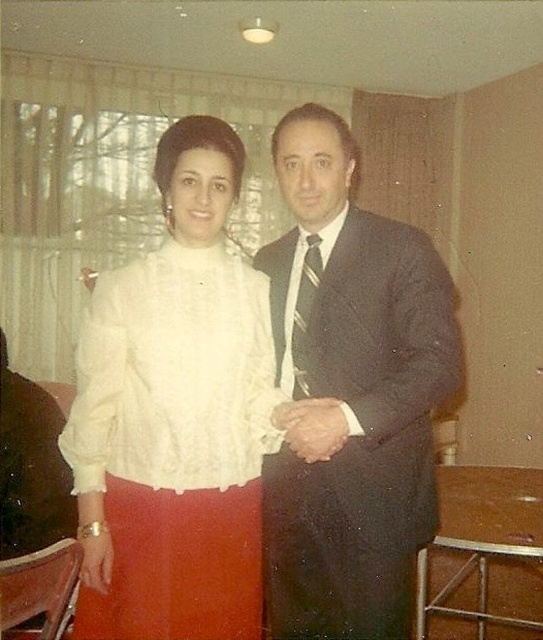
Who is more forward, (282, 192) or (318, 284)?

Point (318, 284)

Is dark gray suit at center below striped silk tie at center?

Indeed, dark gray suit at center is positioned under striped silk tie at center.

Measure the distance between point (381, 429) and camera.

Point (381, 429) and camera are 1.45 meters apart from each other.

The image size is (543, 640). In order to click on dark gray suit at center in this screenshot , I will do `click(350, 396)`.

Can you confirm if white lace blouse at center is bigger than dark gray suit at center?

No, white lace blouse at center is not bigger than dark gray suit at center.

Does white lace blouse at center have a lesser width compared to dark gray suit at center?

In fact, white lace blouse at center might be wider than dark gray suit at center.

Image resolution: width=543 pixels, height=640 pixels. What do you see at coordinates (174, 417) in the screenshot?
I see `white lace blouse at center` at bounding box center [174, 417].

At what (x,y) coordinates should I click in order to perform the action: click on white lace blouse at center. Please return your answer as a coordinate pair (x, y). This screenshot has height=640, width=543. Looking at the image, I should click on (174, 417).

Can you confirm if white lace blouse at center is positioned to the left of striped silk tie at center?

Indeed, white lace blouse at center is positioned on the left side of striped silk tie at center.

Is white lace blouse at center wider than striped silk tie at center?

Yes, white lace blouse at center is wider than striped silk tie at center.

Is point (232, 372) farther from viewer compared to point (311, 314)?

No, (232, 372) is in front of (311, 314).

Locate an element on the screen. white lace blouse at center is located at coordinates (174, 417).